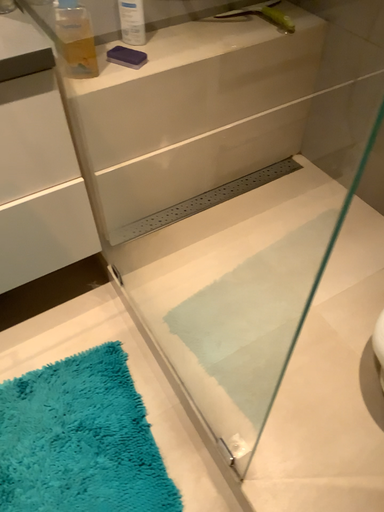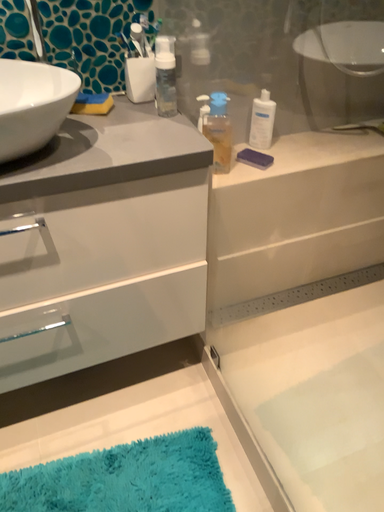
Question: Which way did the camera rotate in the video?

Choices:
 (A) rotated upward
 (B) rotated downward

Answer: (A)